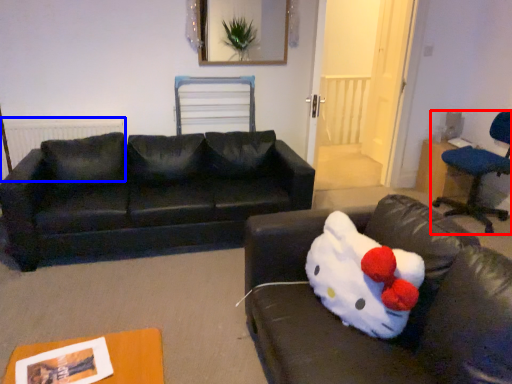
Question: Which object appears closest to the camera in this image, chair (highlighted by a red box) or radiator (highlighted by a blue box)?

Choices:
 (A) chair
 (B) radiator

Answer: (A)